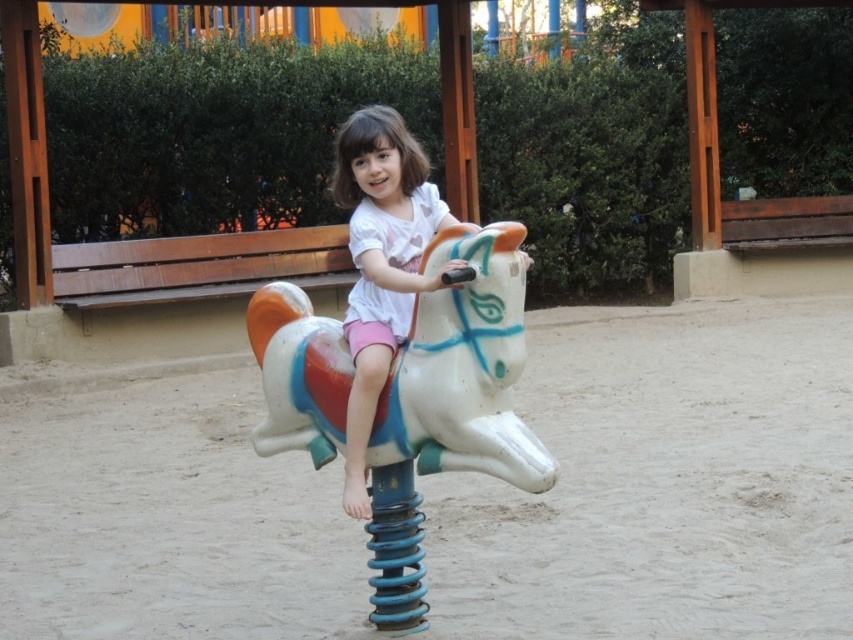
Based on the photo, can you confirm if white sandy ground at center is positioned to the right of matte white horse at center?

In fact, white sandy ground at center is to the left of matte white horse at center.

Which of these two, white sandy ground at center or matte white horse at center, stands shorter?

white sandy ground at center is shorter.

Who is more distant from viewer, (550, 579) or (364, 376)?

The point (550, 579) is more distant.

Locate an element on the screen. white sandy ground at center is located at coordinates (663, 481).

Which is more to the left, white sandy ground at center or white plastic horse at center?

From the viewer's perspective, white sandy ground at center appears more on the left side.

Does white sandy ground at center have a lesser height compared to white plastic horse at center?

Yes.

Does point (114, 609) come closer to viewer compared to point (318, 339)?

No.

Find the location of a particular element. Image resolution: width=853 pixels, height=640 pixels. white sandy ground at center is located at coordinates (663, 481).

Who is taller, white plastic horse at center or matte white horse at center?

white plastic horse at center is taller.

Is white plastic horse at center thinner than matte white horse at center?

In fact, white plastic horse at center might be wider than matte white horse at center.

At what (x,y) coordinates should I click in order to perform the action: click on white plastic horse at center. Please return your answer as a coordinate pair (x, y). Looking at the image, I should click on (450, 408).

Where is `white plastic horse at center`? Image resolution: width=853 pixels, height=640 pixels. white plastic horse at center is located at coordinates (450, 408).